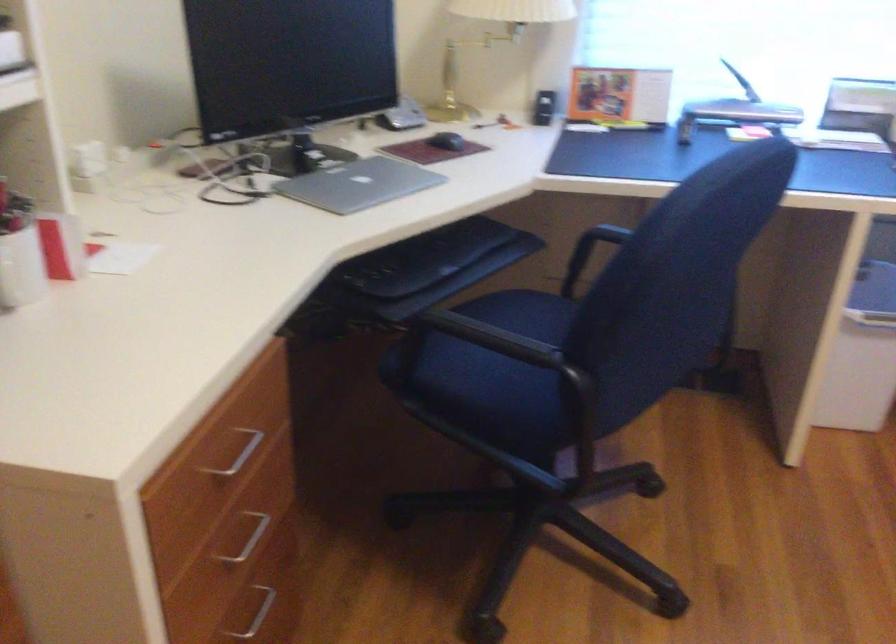
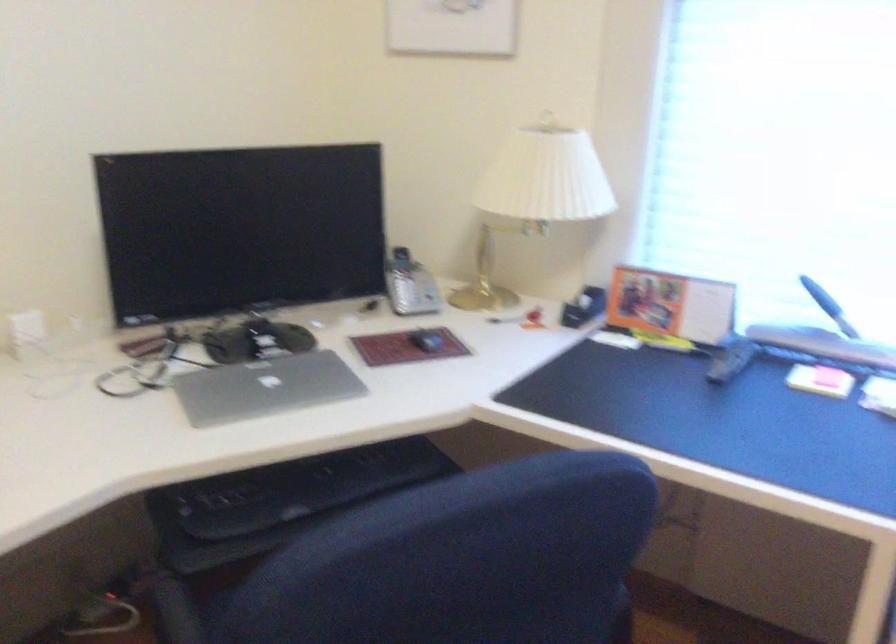
Question: The images are taken continuously from a first-person perspective. In which direction is your viewpoint rotating?

Choices:
 (A) Left
 (B) Right
 (C) Up
 (D) Down

Answer: (A)